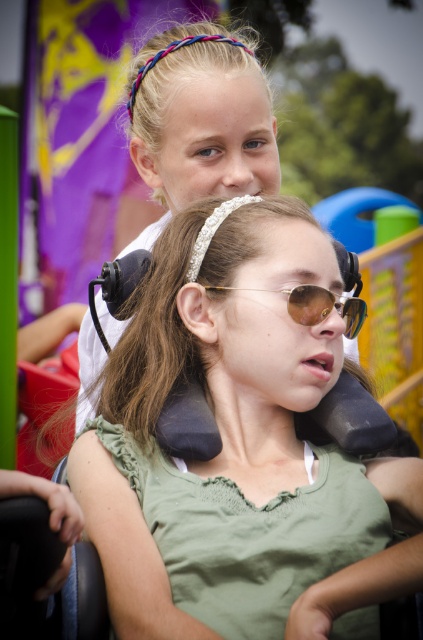
You are an amusement park photographer trying to capture a candid shot of the two friends. You notice the green matte shirt at center and the gold reflective sunglasses at center. Which object should you focus on if you want to capture the one that is higher in the frame?

The green matte shirt at center is taller than gold reflective sunglasses at center, so you should focus on the green matte shirt at center to capture the higher object in the frame.